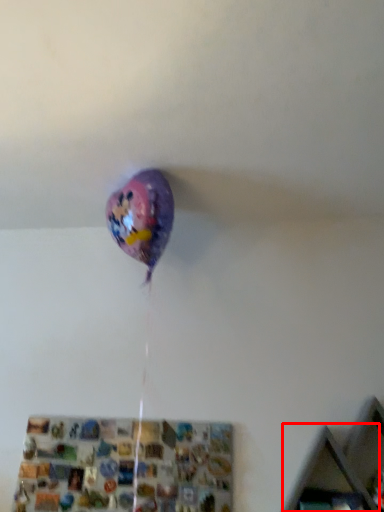
Question: From the image's perspective, considering the relative positions of shelf (annotated by the red box) and shelf in the image provided, where is shelf (annotated by the red box) located with respect to the staircase?

Choices:
 (A) below
 (B) above

Answer: (B)